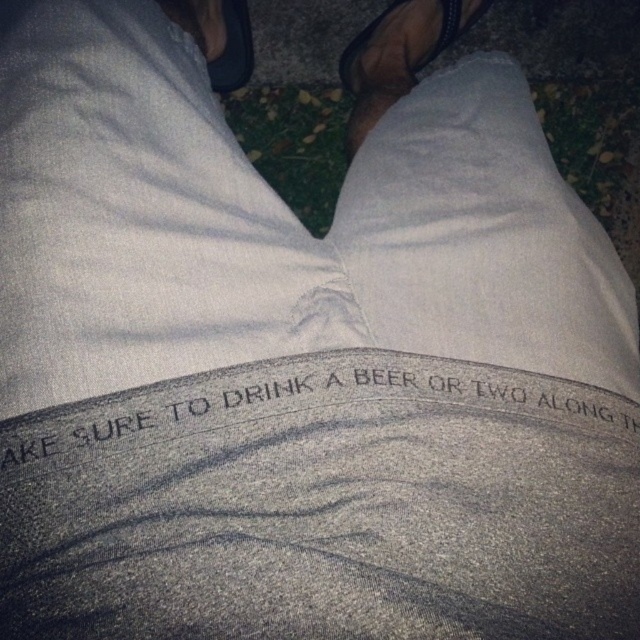
Between point (580, 416) and point (444, 36), which one is positioned behind?

The point (444, 36) is more distant.

Which is behind, point (337, 385) or point (381, 16)?

Positioned behind is point (381, 16).

Where is `black textured text at center`? black textured text at center is located at coordinates (305, 410).